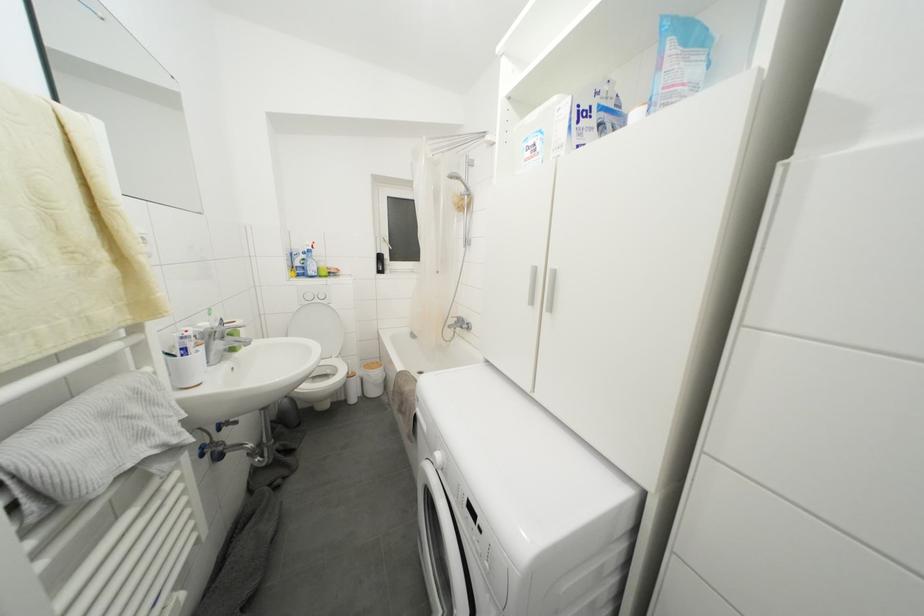
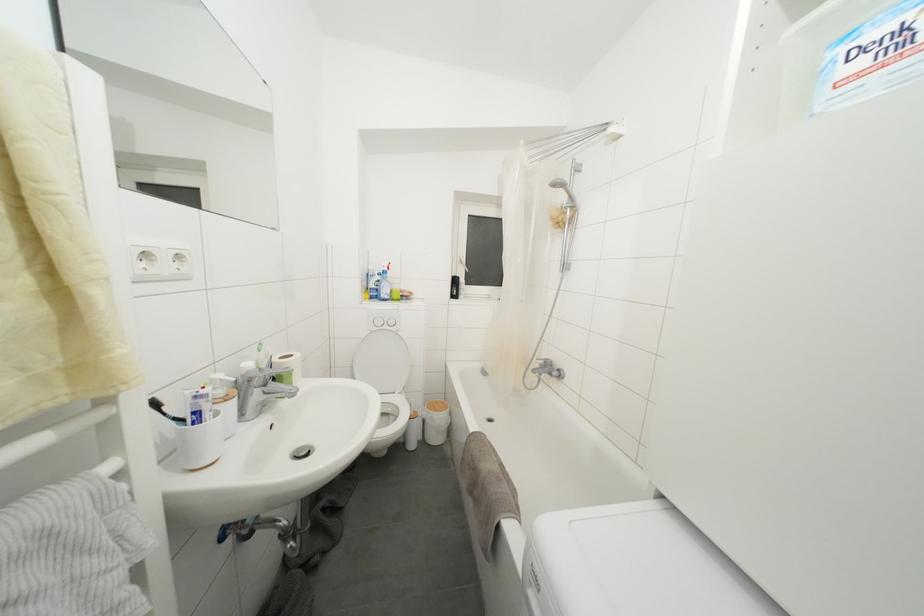
In the second image, find the point that corresponds to [321,305] in the first image.

(390, 331)